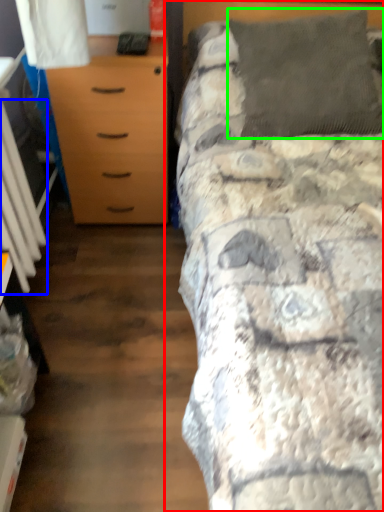
Question: Based on their relative distances, which object is nearer to bed (highlighted by a red box)? Choose from radiator (highlighted by a blue box) and pillow (highlighted by a green box).

Choices:
 (A) radiator
 (B) pillow

Answer: (B)